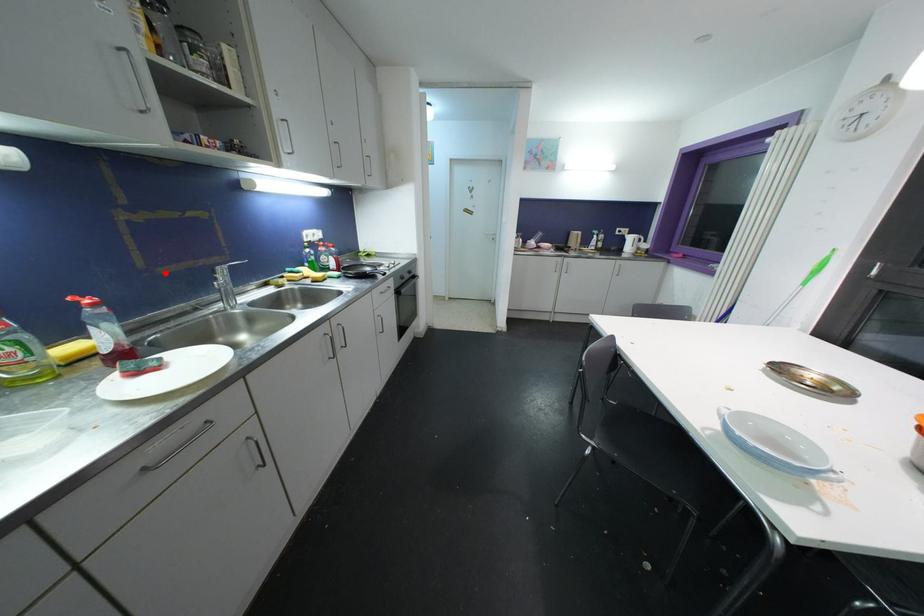
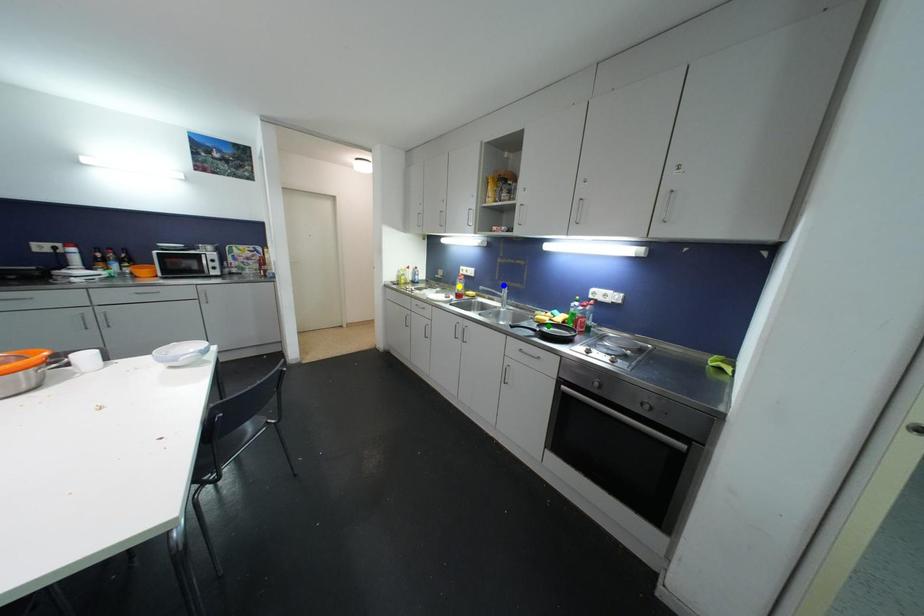
Question: I am providing you with two images of the same scene from different viewpoints. A red point is marked on the first image. You are given multiple points on the second image. In image 2, which mark is for the same physical point as the one in image 1?

Choices:
 (A) blue point
 (B) green point
 (C) yellow point

Answer: (A)